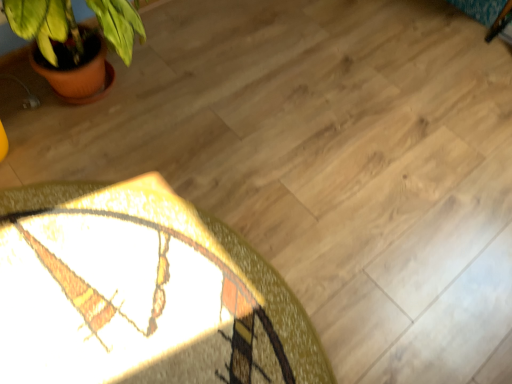
The width and height of the screenshot is (512, 384). In order to click on vacant space behind shiny glass table at center in this screenshot , I will do `click(236, 96)`.